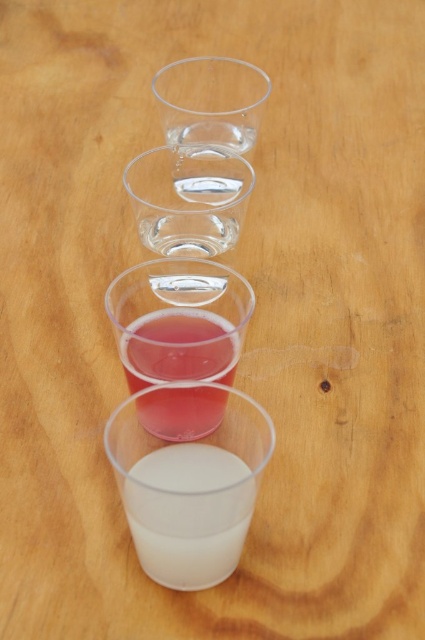
Is translucent plastic cup at center shorter than transparent plastic shot glass at center?

Indeed, translucent plastic cup at center has a lesser height compared to transparent plastic shot glass at center.

Is point (125, 340) behind point (232, 221)?

No.

This screenshot has width=425, height=640. In order to click on translucent plastic cup at center in this screenshot , I will do tap(178, 348).

Who is lower down, white opaque cup at center or translucent plastic cup at center?

white opaque cup at center is lower down.

Can you confirm if white opaque cup at center is positioned to the right of translucent plastic cup at center?

Indeed, white opaque cup at center is positioned on the right side of translucent plastic cup at center.

Is point (234, 540) farther from camera compared to point (158, 365)?

No, (234, 540) is in front of (158, 365).

Locate an element on the screen. This screenshot has width=425, height=640. white opaque cup at center is located at coordinates (189, 515).

Based on the photo, can you confirm if white opaque cup at center is smaller than transparent plastic shot glass at upper center?

Correct, white opaque cup at center occupies less space than transparent plastic shot glass at upper center.

Is point (195, 448) positioned in front of point (229, 58)?

That is True.

The height and width of the screenshot is (640, 425). I want to click on white opaque cup at center, so click(x=189, y=515).